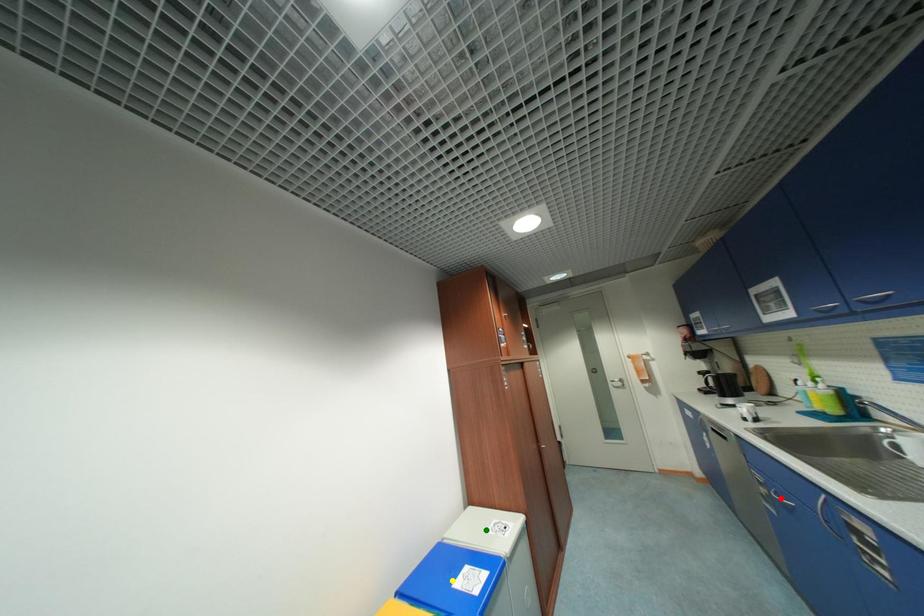
Consider the image. Order these from farthest to nearest:
A) yellow point
B) red point
C) green point

green point, yellow point, red point